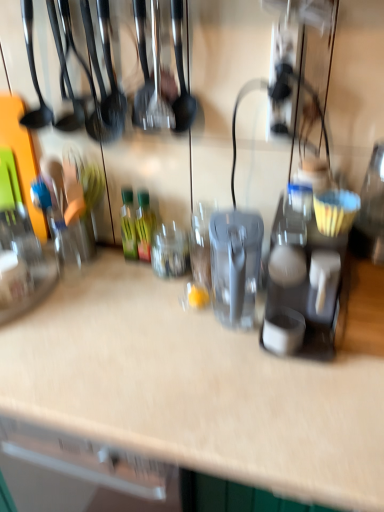
Find the location of a particular element. This screenshot has width=384, height=512. vacant space that is to the left of green glass bottle at center, the 2th bottle viewed from the left is located at coordinates (102, 270).